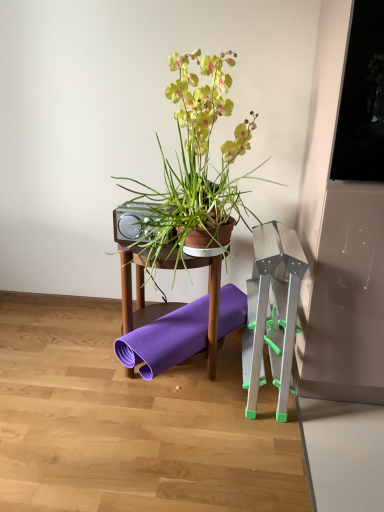
Locate an element on the screen. This screenshot has width=384, height=512. vacant point to the left of wooden table at center is located at coordinates (75, 358).